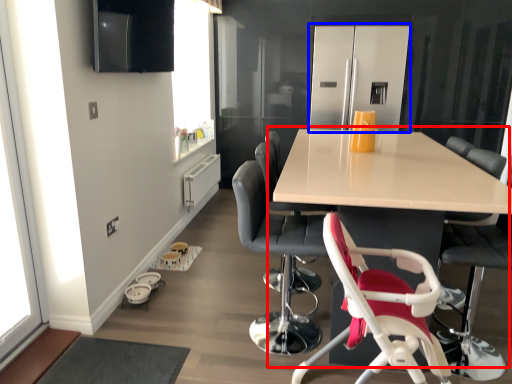
Question: Which point is further to the camera, table (highlighted by a red box) or appliance (highlighted by a blue box)?

Choices:
 (A) table
 (B) appliance

Answer: (B)